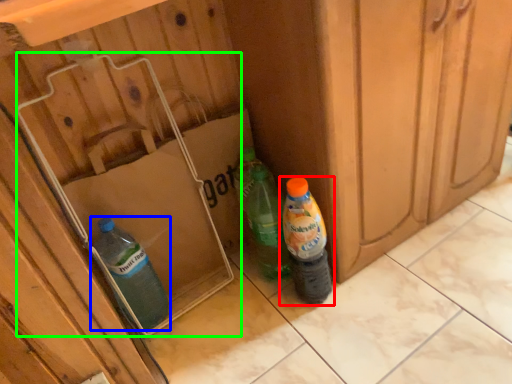
Question: Estimate the real-world distances between objects in this image. Which object is farther from bottle (highlighted by a red box), bottle (highlighted by a blue box) or cardboard box (highlighted by a green box)?

Choices:
 (A) bottle
 (B) cardboard box

Answer: (A)